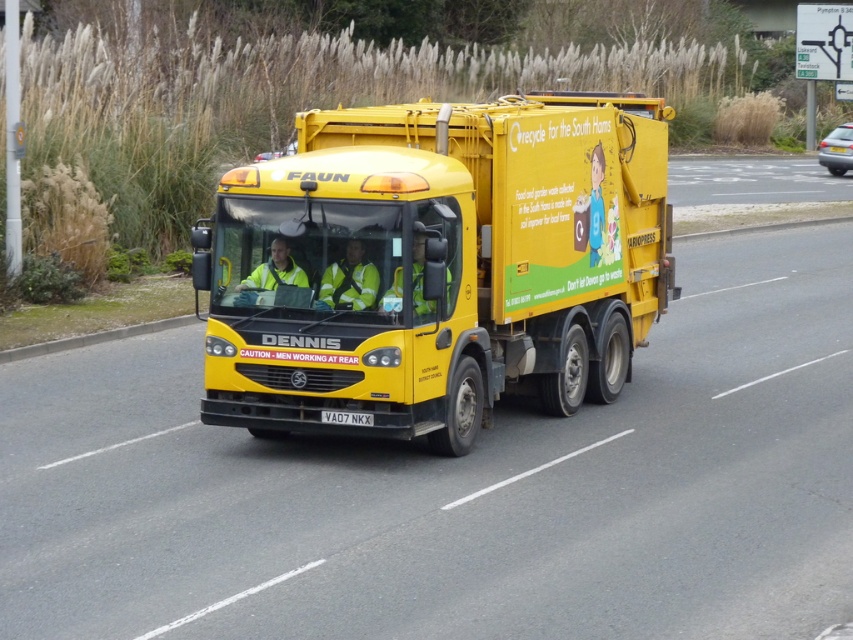
Can you confirm if yellow matte trailer truck at center is thinner than metallic silver car at right?

Yes.

Measure the distance between yellow matte trailer truck at center and camera.

yellow matte trailer truck at center and camera are 11.36 meters apart from each other.

Find the location of a particular element. The image size is (853, 640). yellow matte trailer truck at center is located at coordinates (437, 264).

Is yellow matte trailer truck at center behind black plastic license plate at center?

Yes, yellow matte trailer truck at center is further from the viewer.

Does yellow matte trailer truck at center come in front of black plastic license plate at center?

No, it is not.

Is point (314, 324) positioned in front of point (350, 422)?

Yes.

Find the location of `yellow matte trailer truck at center`. yellow matte trailer truck at center is located at coordinates (437, 264).

Is metallic silver car at right shorter than black plastic license plate at center?

Incorrect, metallic silver car at right's height does not fall short of black plastic license plate at center's.

Which is behind, point (837, 144) or point (358, 422)?

Positioned behind is point (837, 144).

Who is more forward, (833, 131) or (335, 413)?

Point (335, 413) is in front.

You are a GUI agent. You are given a task and a screenshot of the screen. Output one action in this format:
    pyautogui.click(x=<x>, y=<y>)
    Task: Click on the metallic silver car at right
    This screenshot has width=853, height=640.
    Given the screenshot: What is the action you would take?
    pyautogui.click(x=836, y=148)